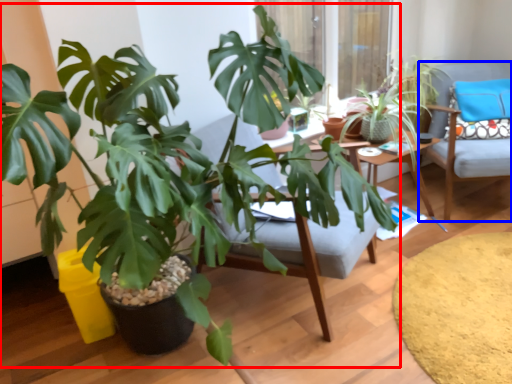
Question: Which point is further to the camera, houseplant (highlighted by a red box) or chair (highlighted by a blue box)?

Choices:
 (A) houseplant
 (B) chair

Answer: (B)